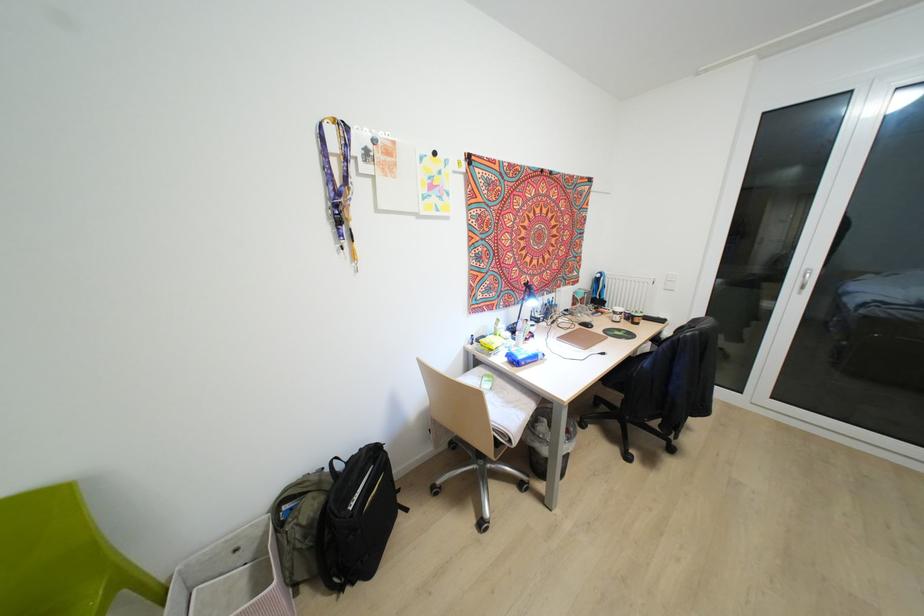
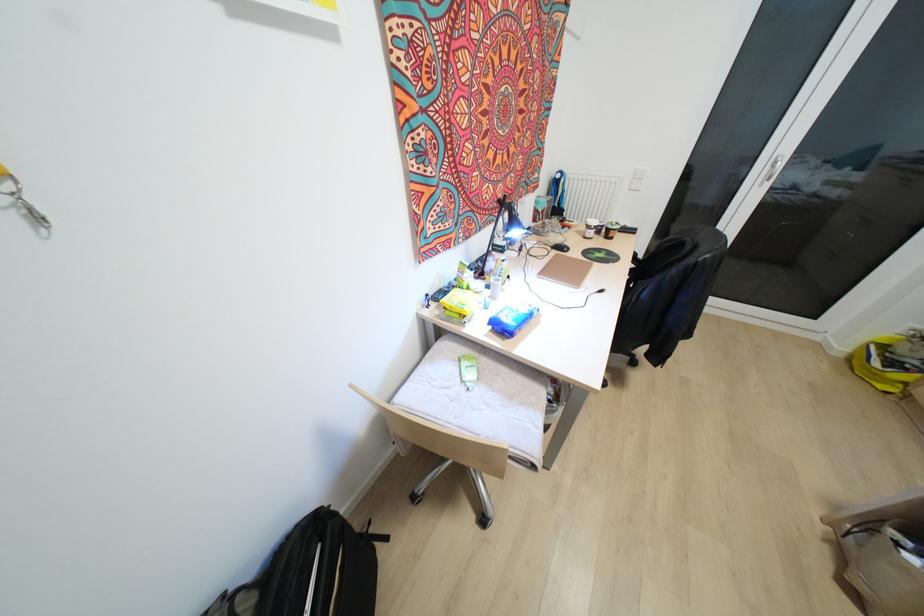
Find the pixel in the second image that matches pixel 526 284 in the first image.

(499, 201)